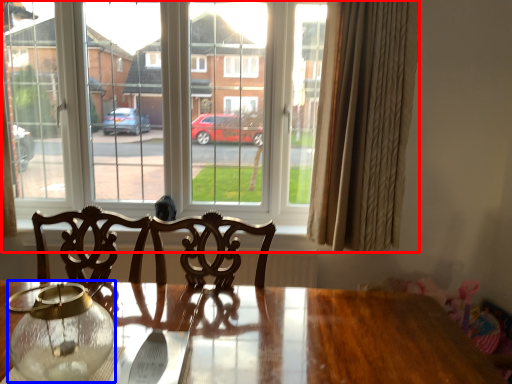
Question: Which object is closer to the camera taking this photo, window (highlighted by a red box) or glass vase (highlighted by a blue box)?

Choices:
 (A) window
 (B) glass vase

Answer: (B)